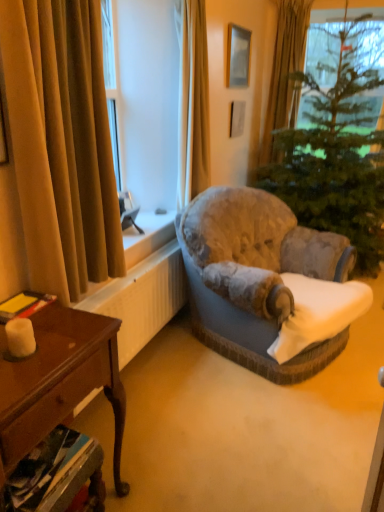
Locate an element on the screen. free space in front of white textured radiator at lower left is located at coordinates (175, 422).